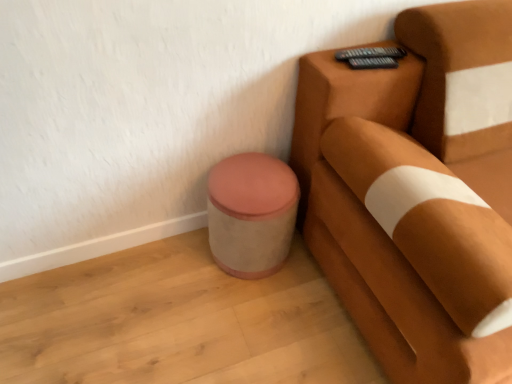
At what (x,y) coordinates should I click in order to perform the action: click on free point above pink fabric ottoman at lower left (from a real-world perspective). Please return your answer as a coordinate pair (x, y). The image size is (512, 384). Looking at the image, I should click on (247, 178).